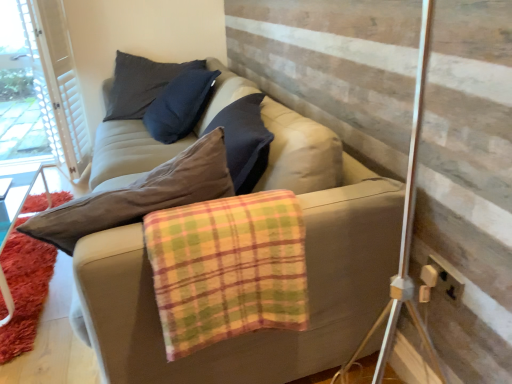
Question: Considering the positions of beige plastic socket at lower right and beige fabric couch at center in the image, is beige plastic socket at lower right bigger or smaller than beige fabric couch at center?

Choices:
 (A) big
 (B) small

Answer: (B)

Question: From the image's perspective, is beige plastic socket at lower right above or below beige fabric couch at center?

Choices:
 (A) below
 (B) above

Answer: (A)

Question: Considering the real-world distances, which object is closest to the plaid flannel blanket at center?

Choices:
 (A) beige fabric couch at center
 (B) shaggy orange rug at lower left
 (C) beige plastic socket at lower right
 (D) white textured barn door at upper left

Answer: (A)

Question: Which object is positioned farthest from the white textured barn door at upper left?

Choices:
 (A) shaggy orange rug at lower left
 (B) beige plastic socket at lower right
 (C) beige fabric couch at center
 (D) plaid flannel blanket at center

Answer: (B)